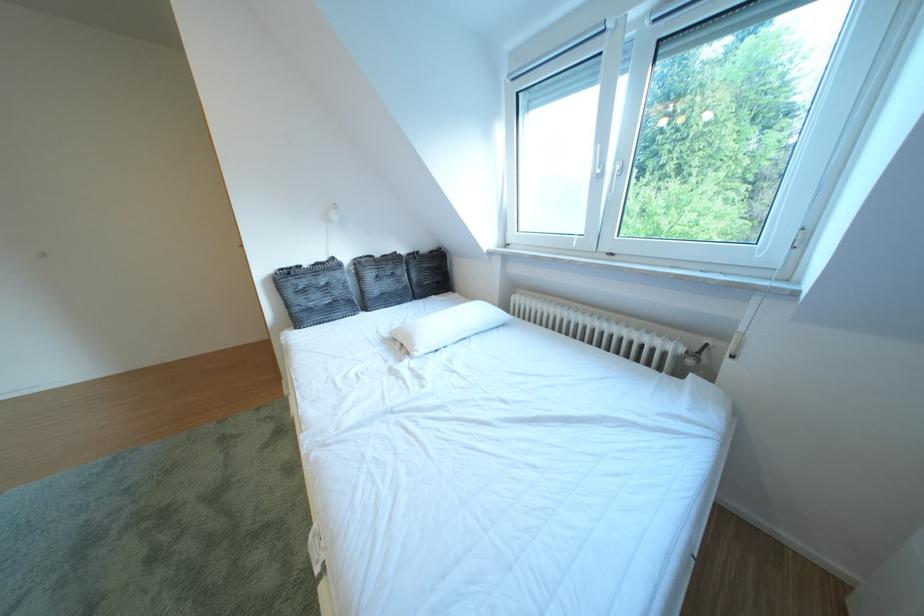
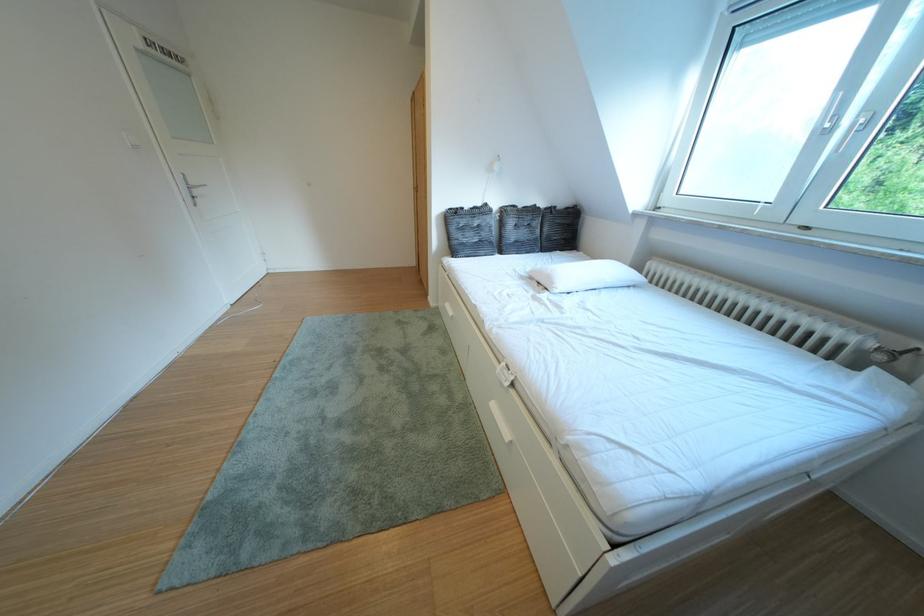
The point at (310,314) is marked in the first image. Where is the corresponding point in the second image?

(468, 246)